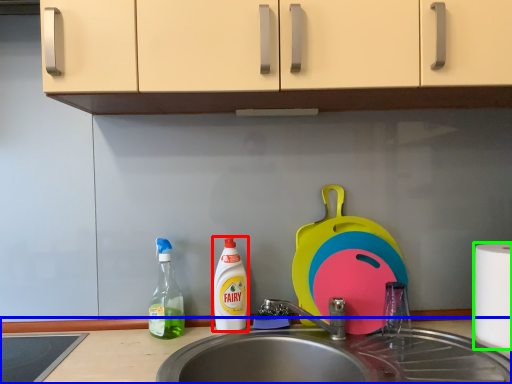
Question: Considering the real-world distances, which object is closest to cleaning product (highlighted by a red box)? countertop (highlighted by a blue box) or paper towel (highlighted by a green box).

Choices:
 (A) countertop
 (B) paper towel

Answer: (A)